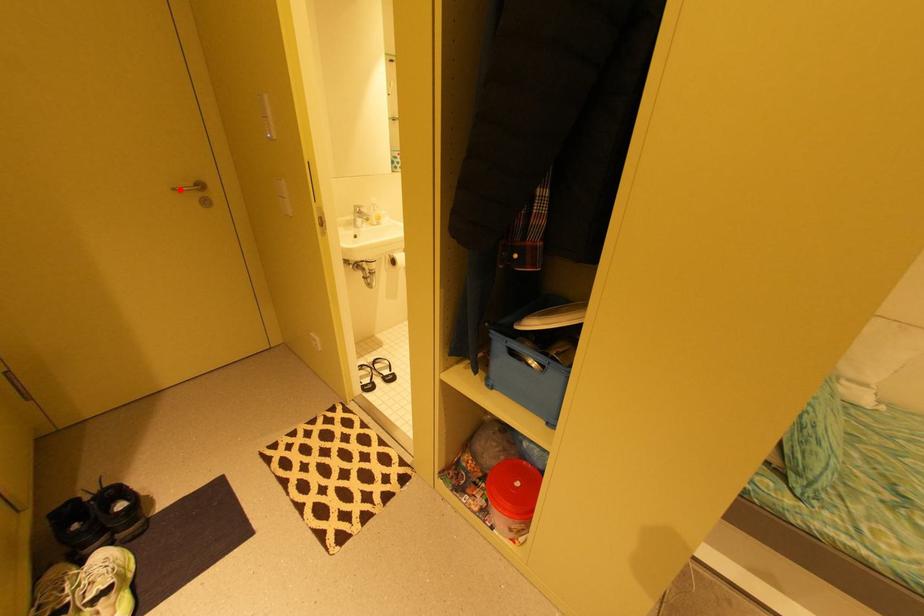
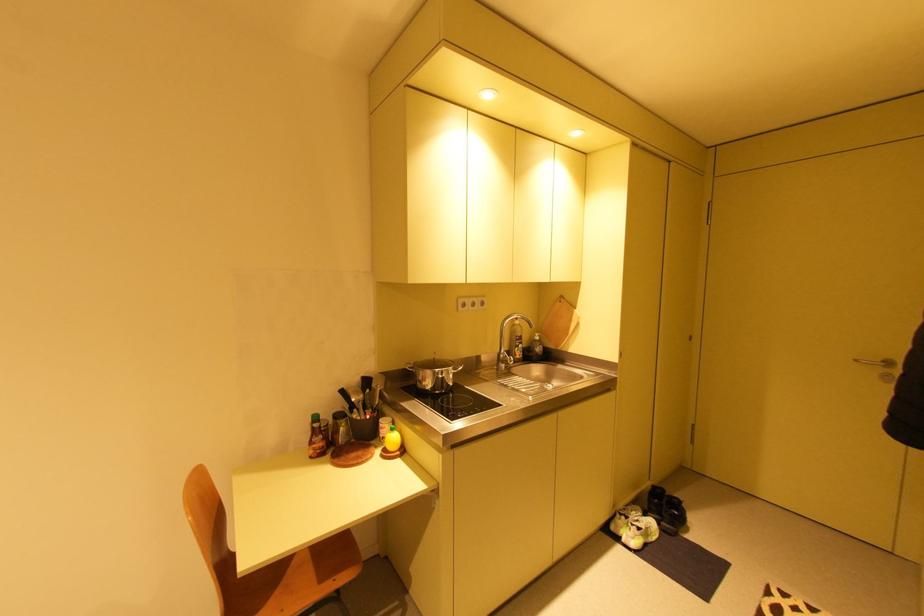
Question: I am providing you with two images of the same scene from different viewpoints. In image1, a red point is highlighted. Considering the same 3D point in image2, which of the following is correct?

Choices:
 (A) It is closer
 (B) It is farther

Answer: (B)